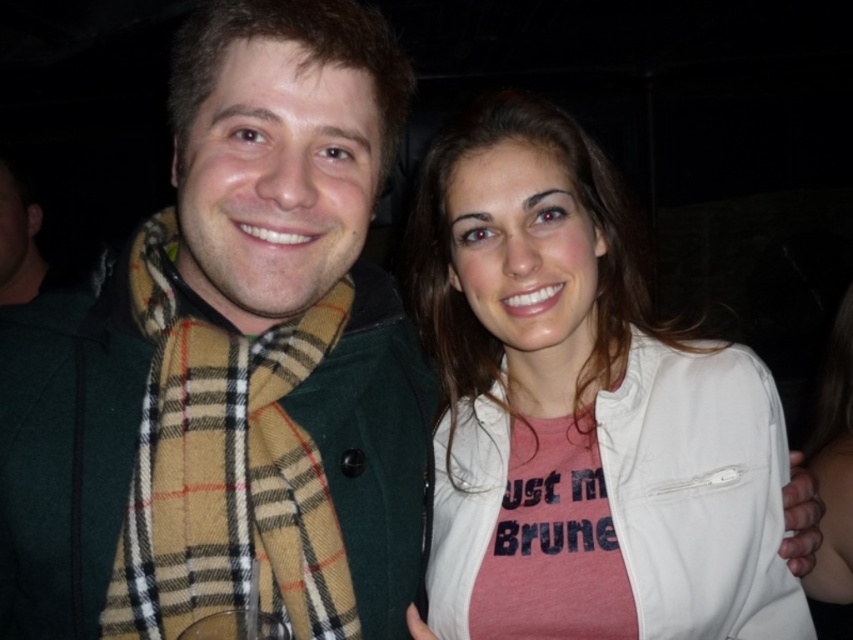
Does point (340, 192) come closer to viewer compared to point (479, 573)?

Yes, it is in front of point (479, 573).

Is point (311, 504) positioned behind point (514, 182)?

That is False.

The image size is (853, 640). I want to click on green wool scarf at center, so click(x=233, y=364).

Between white matte jacket at upper right and smooth white shirt at center, which one is positioned higher?

Positioned higher is white matte jacket at upper right.

The width and height of the screenshot is (853, 640). What do you see at coordinates (550, 387) in the screenshot?
I see `white matte jacket at upper right` at bounding box center [550, 387].

Does point (601, 483) come behind point (848, 481)?

No.

Where is `white matte jacket at upper right`? Image resolution: width=853 pixels, height=640 pixels. white matte jacket at upper right is located at coordinates (550, 387).

Is point (242, 186) closer to viewer compared to point (813, 609)?

Yes, it is in front of point (813, 609).

Which of these two, green wool scarf at center or smooth white shirt at center, stands shorter?

green wool scarf at center is shorter.

The width and height of the screenshot is (853, 640). What do you see at coordinates (233, 364) in the screenshot?
I see `green wool scarf at center` at bounding box center [233, 364].

Where is `green wool scarf at center`? green wool scarf at center is located at coordinates (233, 364).